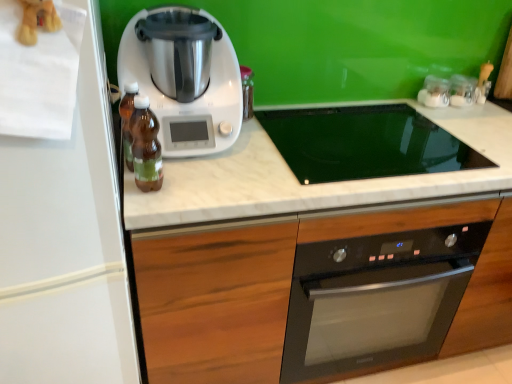
Locate an element on the screen. vacant space to the right of brown glass bottle at center, marked as the second bottle in a back-to-front arrangement is located at coordinates (210, 187).